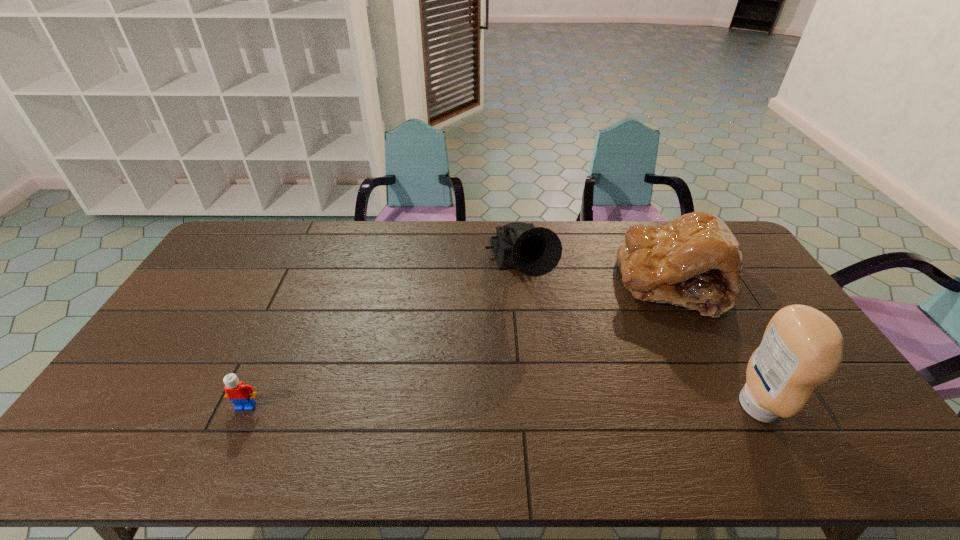
Identify the location of free space on the desktop that is between the Lego and the condiment and is positioned from the horn of the phonograph_record. This screenshot has width=960, height=540. (568, 406).

At what (x,y) coordinates should I click in order to perform the action: click on free spot on the desktop that is between the Lego and the condiment and is positioned on the filling side of the second shortest object. Please return your answer as a coordinate pair (x, y). Looking at the image, I should click on (541, 406).